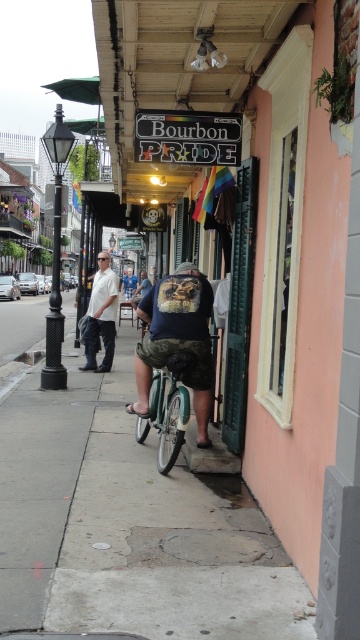
Does concrete at center have a greater width compared to denim shorts at center?

Correct, the width of concrete at center exceeds that of denim shorts at center.

Can you confirm if concrete at center is taller than denim shorts at center?

No.

The height and width of the screenshot is (640, 360). Identify the location of concrete at center. (127, 522).

At what (x,y) coordinates should I click in order to perform the action: click on concrete at center. Please return your answer as a coordinate pair (x, y). Looking at the image, I should click on click(x=127, y=522).

Can you confirm if concrete at center is positioned to the right of denim pants at left?

Indeed, concrete at center is positioned on the right side of denim pants at left.

Locate an element on the screen. This screenshot has height=640, width=360. concrete at center is located at coordinates (127, 522).

Does denim pants at left have a greater width compared to denim shorts at center?

In fact, denim pants at left might be narrower than denim shorts at center.

Which is more to the left, denim pants at left or denim shorts at center?

denim shorts at center is more to the left.

At what (x,y) coordinates should I click in order to perform the action: click on denim pants at left. Please return your answer as a coordinate pair (x, y). This screenshot has height=640, width=360. Looking at the image, I should click on (101, 316).